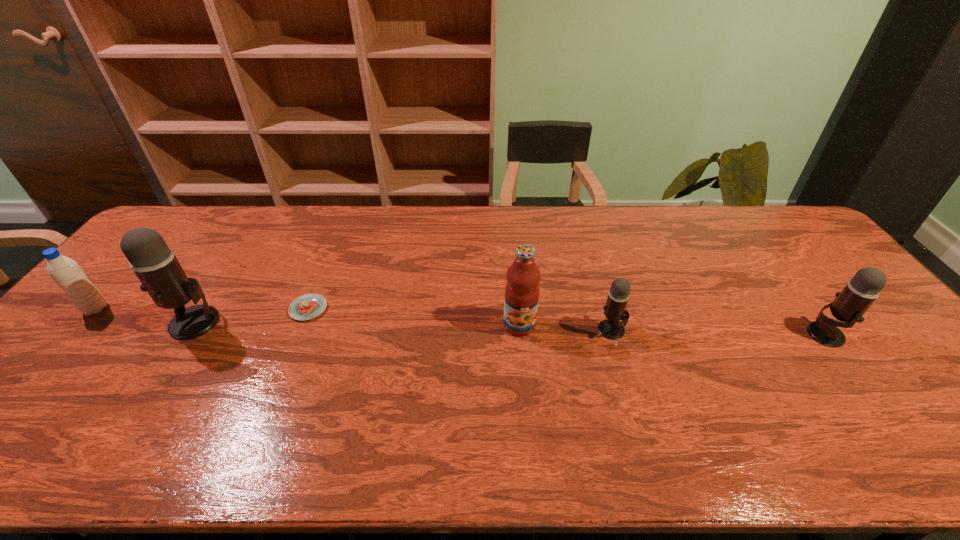
Where is `free space at the far left corner`? free space at the far left corner is located at coordinates (207, 226).

The height and width of the screenshot is (540, 960). What are the coordinates of `unoccupied position between the rightmost microphone and the fruit juice` in the screenshot? It's located at (672, 329).

You are a GUI agent. You are given a task and a screenshot of the screen. Output one action in this format:
    pyautogui.click(x=<x>, y=<y>)
    Task: Click on the unoccupied area between the rightmost object and the fruit juice
    
    Given the screenshot: What is the action you would take?
    pyautogui.click(x=672, y=329)

Find the location of a particular element. free space between the fifth object from right to left and the third object from left to right is located at coordinates (252, 315).

I want to click on vacant region between the fruit juice and the rightmost microphone, so click(672, 329).

Identify the location of empty space that is in between the third object from left to right and the rightmost object. (566, 321).

Image resolution: width=960 pixels, height=540 pixels. Identify the location of free space between the shortest microphone and the leftmost object. (353, 320).

This screenshot has height=540, width=960. Identify the location of vacant point located between the fourth object from left to right and the leftmost microphone. (357, 323).

I want to click on blank region between the rightmost object and the shortest object, so click(x=566, y=321).

I want to click on free spot between the second shortest microphone and the fifth object from left to right, so [718, 332].